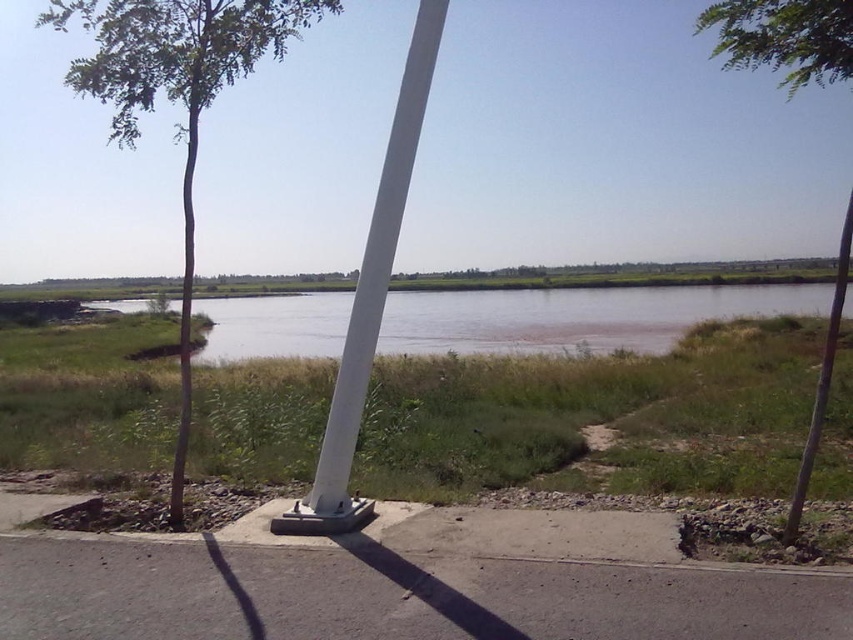
You are a hiker who wants to cross the brown sedimentary river at center. You notice the gray asphalt pavement at lower center nearby. Which surface is larger in area between the two?

The brown sedimentary river at center has a larger area than the gray asphalt pavement at lower center.

Consider the image. You are standing at the edge of the water in the scene and want to walk towards the point labeled as point (x=834, y=10). Which direction should you go relative to the point labeled as point (x=341, y=528)?

You should move away from the point (x=341, y=528) because point (x=834, y=10) is farther from the camera than point (x=341, y=528), meaning it is located deeper into the scene.